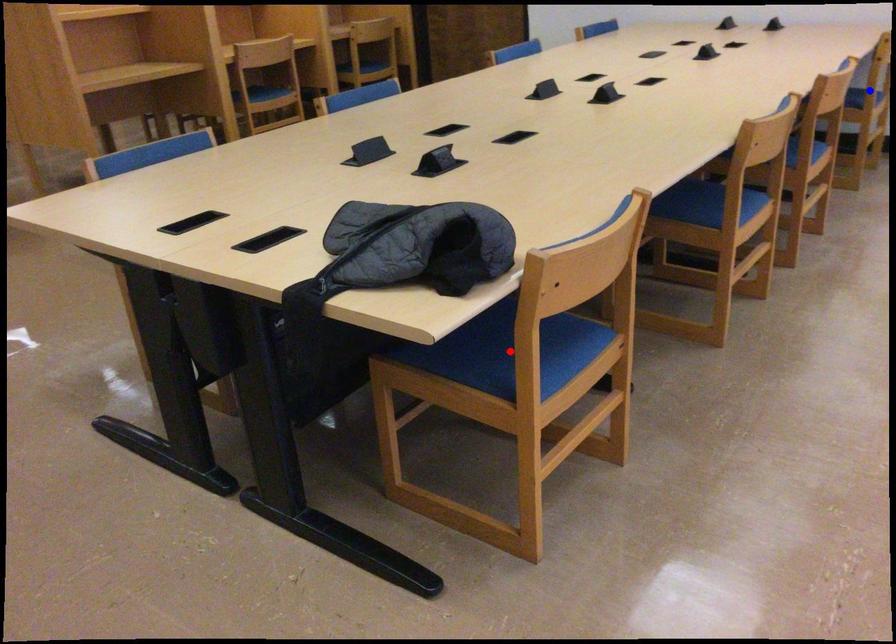
Question: Two points are marked on the image. Which point is closer to the camera?

Choices:
 (A) Blue point is closer.
 (B) Red point is closer.

Answer: (B)